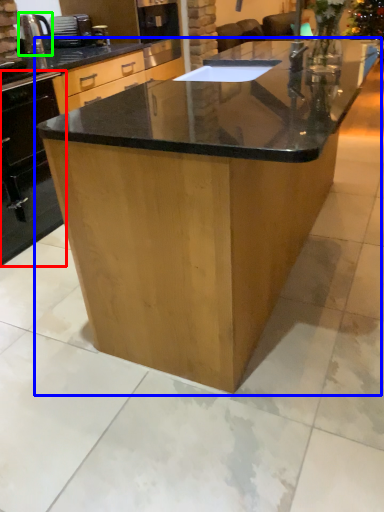
Question: Estimate the real-world distances between objects in this image. Which object is farther from oven (highlighted by a red box), table (highlighted by a blue box) or kitchen appliance (highlighted by a green box)?

Choices:
 (A) table
 (B) kitchen appliance

Answer: (A)